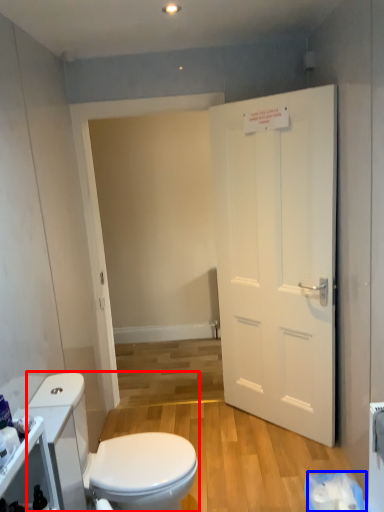
Question: Among these objects, which one is nearest to the camera, toilet (highlighted by a red box) or toilet paper (highlighted by a blue box)?

Choices:
 (A) toilet
 (B) toilet paper

Answer: (A)